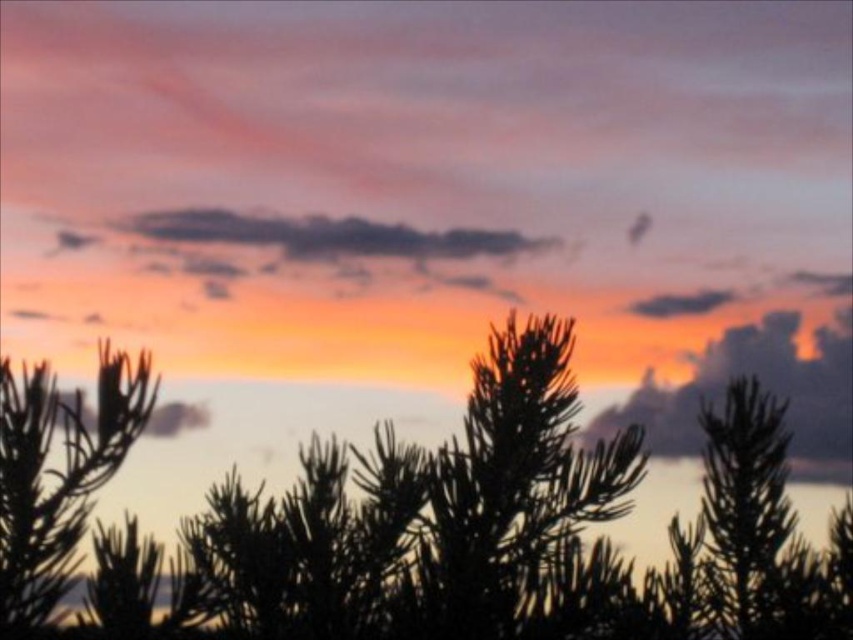
Question: Can you confirm if silvery green needles at left is positioned above dark gray cloud at upper center?

Choices:
 (A) yes
 (B) no

Answer: (B)

Question: Which object is positioned farthest from the silhouette pine tree at center?

Choices:
 (A) silvery green needles at left
 (B) dark gray cloud at upper center

Answer: (B)

Question: Does silvery green needles at left lie behind dark gray cloud at upper center?

Choices:
 (A) no
 (B) yes

Answer: (A)

Question: Which of these objects is positioned closest to the dark gray cloud at upper center?

Choices:
 (A) silhouette pine tree at center
 (B) silvery green needles at left

Answer: (A)

Question: Which point is farther from the camera taking this photo?

Choices:
 (A) (51, 548)
 (B) (334, 545)
 (C) (674, 305)

Answer: (C)

Question: From the image, what is the correct spatial relationship of silhouette pine tree at center in relation to silvery green needles at left?

Choices:
 (A) right
 (B) left

Answer: (A)